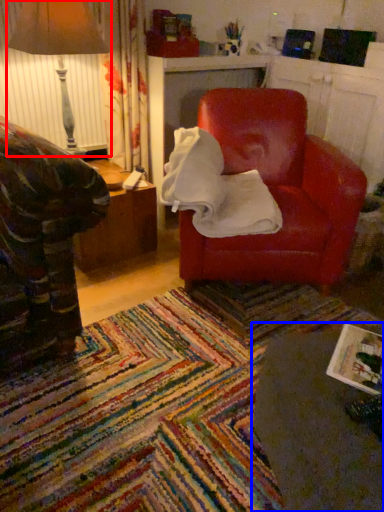
Question: Among these objects, which one is farthest to the camera, table lamp (highlighted by a red box) or table (highlighted by a blue box)?

Choices:
 (A) table lamp
 (B) table

Answer: (A)